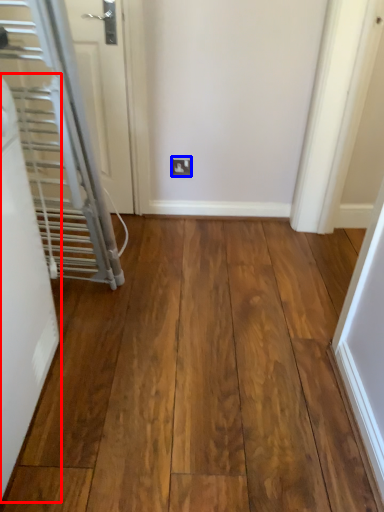
Question: Which object appears closest to the camera in this image, door (highlighted by a red box) or electric outlet (highlighted by a blue box)?

Choices:
 (A) door
 (B) electric outlet

Answer: (A)